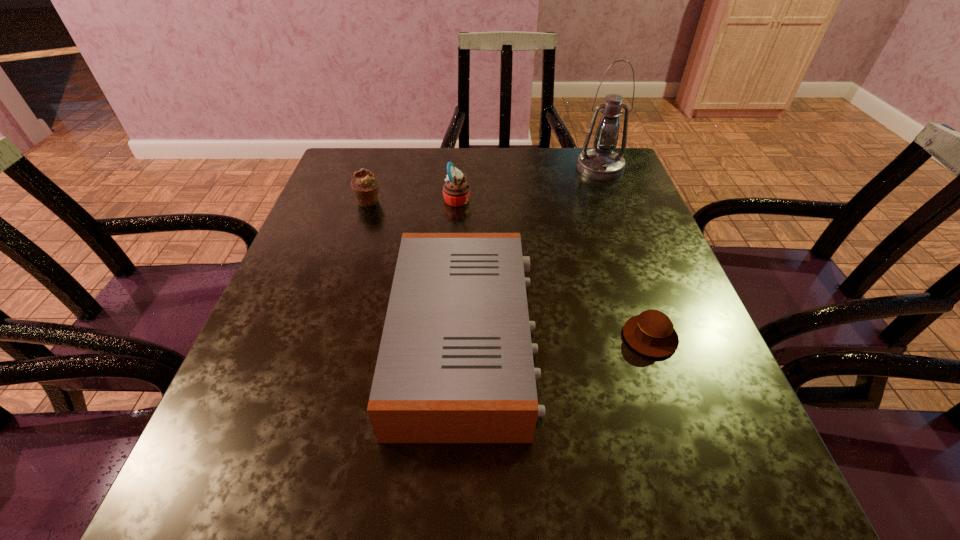
At what (x,y) coordinates should I click in order to perform the action: click on free space between the farthest object and the rightmost muffin. Please return your answer as a coordinate pair (x, y). Looking at the image, I should click on (625, 252).

The width and height of the screenshot is (960, 540). Identify the location of free space between the radio receiver and the farthest object. (533, 254).

Where is `the third closest object to the nearest muffin`? the third closest object to the nearest muffin is located at coordinates (602, 163).

Find the location of a particular element. The height and width of the screenshot is (540, 960). object identified as the third closest to the radio receiver is located at coordinates (365, 185).

Select which muffin is the second closest to the second muffin from right to left. Please provide its 2D coordinates. Your answer should be formatted as a tuple, i.e. [(x, y)], where the tuple contains the x and y coordinates of a point satisfying the conditions above.

[(651, 333)]

Identify which muffin is the closest to the farthest object. Please provide its 2D coordinates. Your answer should be formatted as a tuple, i.e. [(x, y)], where the tuple contains the x and y coordinates of a point satisfying the conditions above.

[(456, 191)]

Identify the location of free space that satisfies the following two spatial constraints: 1. on the front side of the shortest object; 2. on the right side of the leftmost muffin. click(x=325, y=337).

Image resolution: width=960 pixels, height=540 pixels. Identify the location of free space that satisfies the following two spatial constraints: 1. on the front-facing side of the shortest muffin; 2. on the right side of the second muffin from right to left. (447, 337).